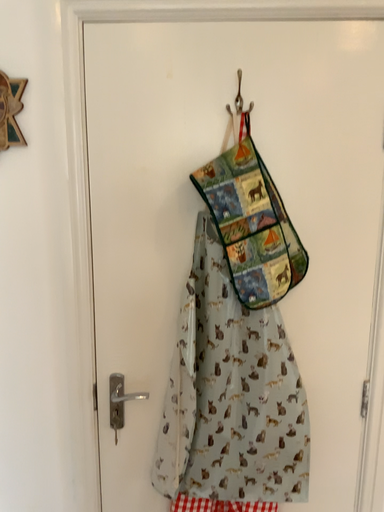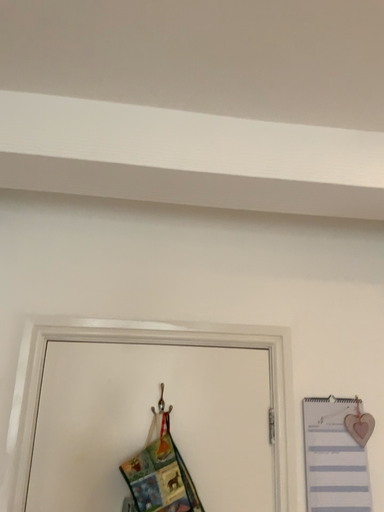
Question: Which way did the camera rotate in the video?

Choices:
 (A) rotated downward
 (B) rotated upward

Answer: (B)